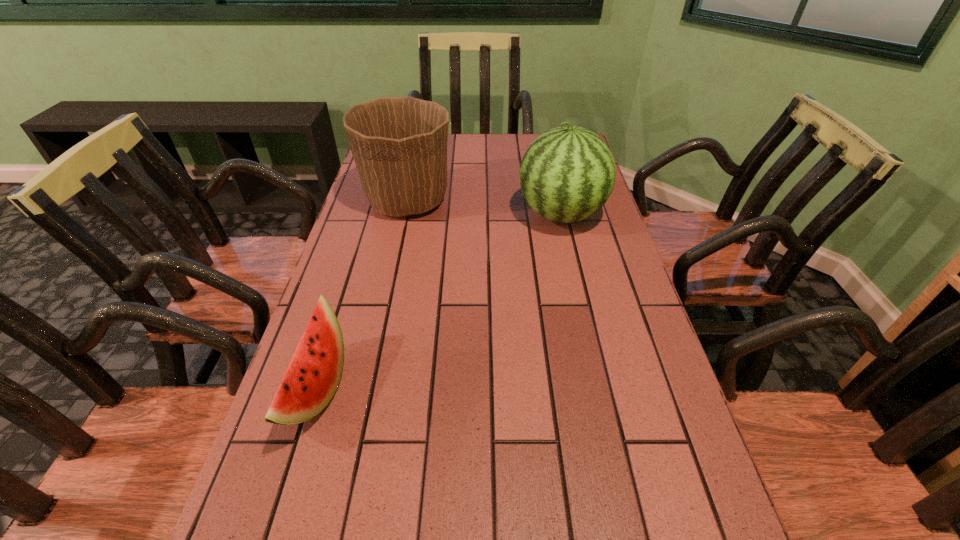
Identify which object is located as the second nearest to the flowerpot. Please provide its 2D coordinates. Your answer should be formatted as a tuple, i.e. [(x, y)], where the tuple contains the x and y coordinates of a point satisfying the conditions above.

[(313, 375)]

Image resolution: width=960 pixels, height=540 pixels. What are the coordinates of `free location that satisfies the following two spatial constraints: 1. on the front side of the flowerpot; 2. on the outer rind of the nearest object` in the screenshot? It's located at (367, 389).

In order to click on free space that satisfies the following two spatial constraints: 1. on the front side of the rightmost object; 2. on the right side of the flowerpot in this screenshot , I will do `click(404, 214)`.